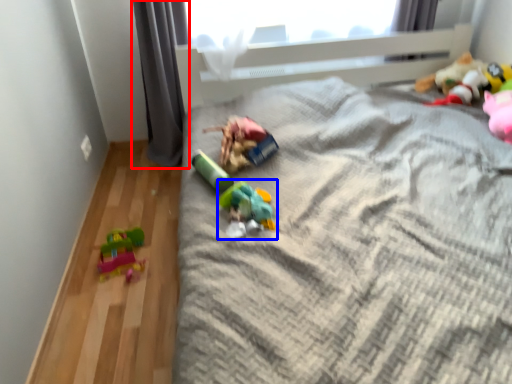
Question: Which object is closer to the camera taking this photo, curtain (highlighted by a red box) or toy (highlighted by a blue box)?

Choices:
 (A) curtain
 (B) toy

Answer: (B)